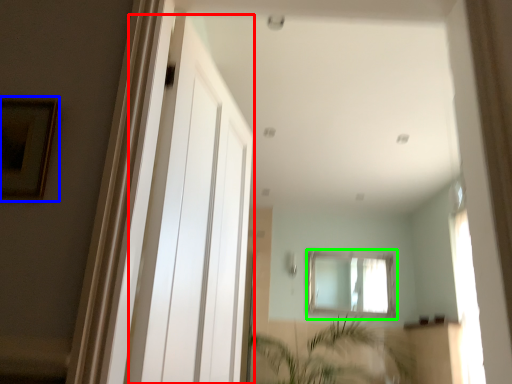
Question: Considering the real-world distances, which object is farthest from screen door (highlighted by a red box)? picture frame (highlighted by a blue box) or window (highlighted by a green box)?

Choices:
 (A) picture frame
 (B) window

Answer: (B)